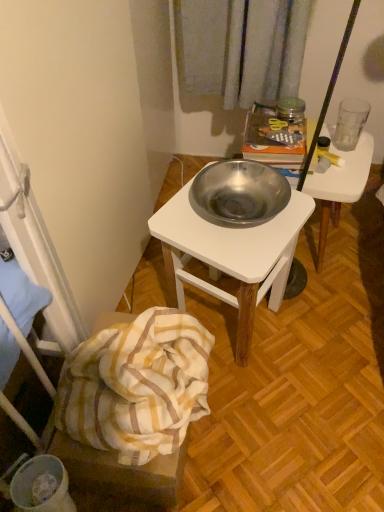
This screenshot has width=384, height=512. Find the location of `vacant area on top of metallic white desk at center, marked as the first desk in a right-to-left arrangement (from a real-world perspective)`. vacant area on top of metallic white desk at center, marked as the first desk in a right-to-left arrangement (from a real-world perspective) is located at coordinates (344, 158).